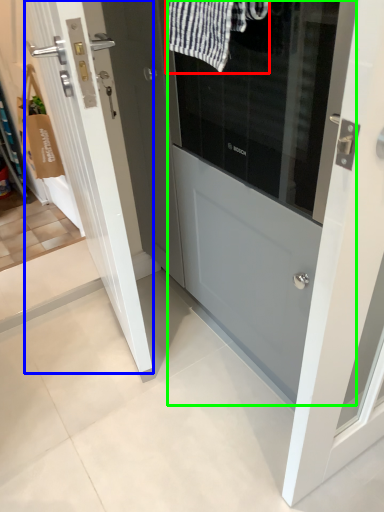
Question: Which object is the closest to the bath towel (highlighted by a red box)? Choose among these: door (highlighted by a blue box) or door (highlighted by a green box).

Choices:
 (A) door
 (B) door

Answer: (B)